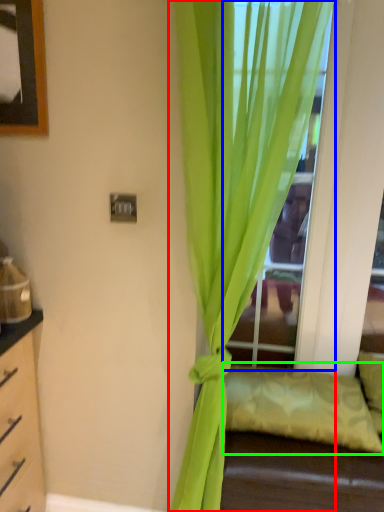
Question: Which object is positioned farthest from curtain (highlighted by a red box)? Select from glass door (highlighted by a blue box) and pillow (highlighted by a green box).

Choices:
 (A) glass door
 (B) pillow

Answer: (B)